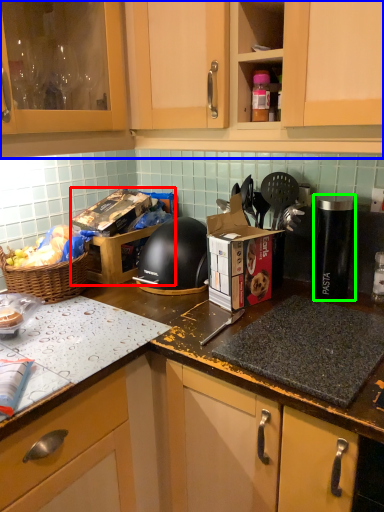
Question: Which object is positioned closest to cardboard box (highlighted by a red box)? Select from cabinetry (highlighted by a blue box) and appliance (highlighted by a green box).

Choices:
 (A) cabinetry
 (B) appliance

Answer: (A)